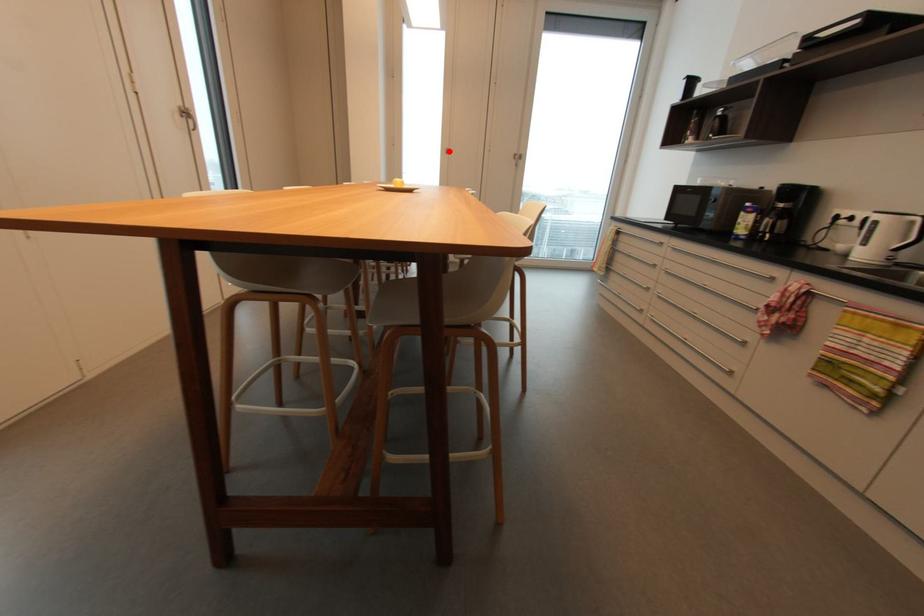
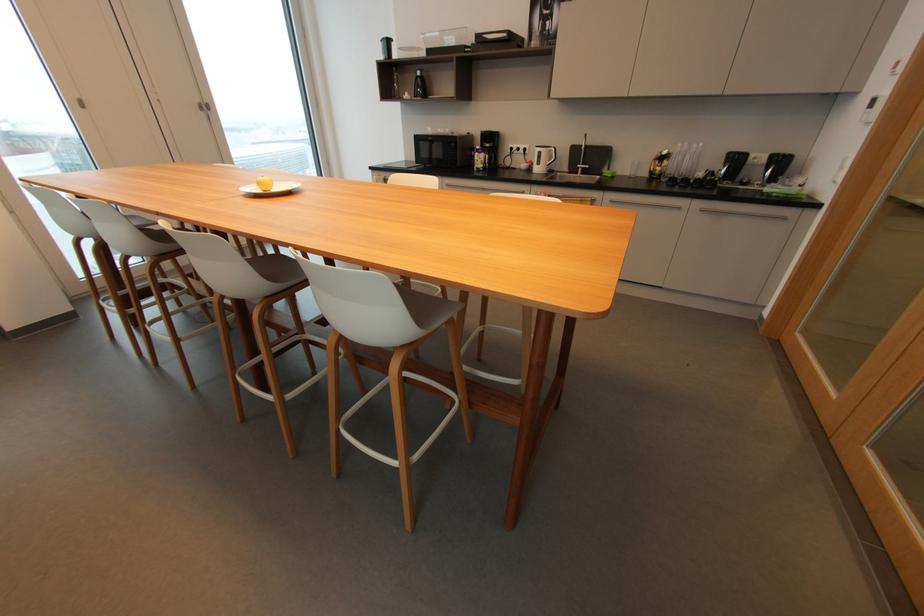
Question: I am providing you with two images of the same scene from different viewpoints. Image1 has a red point marked. In image2, the corresponding 3D location appears at what relative position? Reply with the corresponding letter.

Choices:
 (A) Closer
 (B) Farther

Answer: (A)